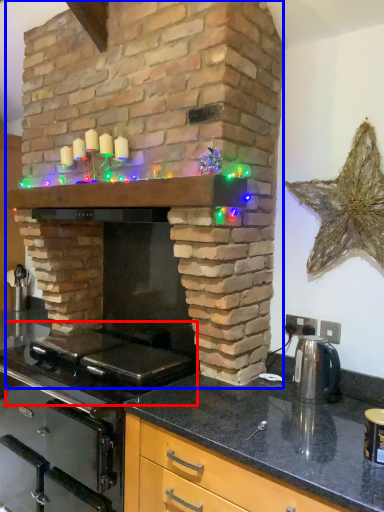
Question: Among these objects, which one is farthest to the camera, gas stove (highlighted by a red box) or fireplace (highlighted by a blue box)?

Choices:
 (A) gas stove
 (B) fireplace

Answer: (A)